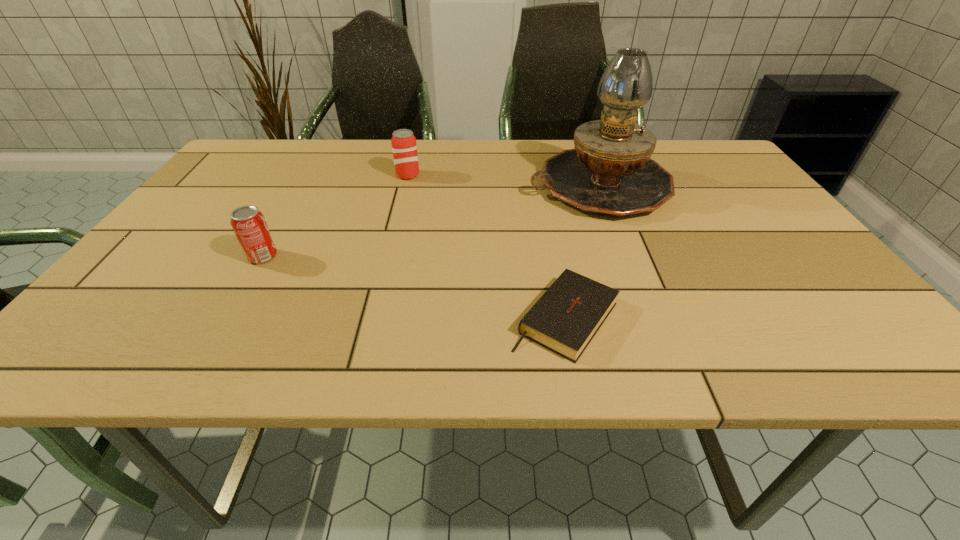
Find the location of a particular element. free region that satisfies the following two spatial constraints: 1. on the front side of the beer can; 2. on the left side of the oil lamp is located at coordinates (405, 186).

The width and height of the screenshot is (960, 540). Find the location of `free location that satisfies the following two spatial constraints: 1. on the front side of the shortest object; 2. on the left side of the soda can`. free location that satisfies the following two spatial constraints: 1. on the front side of the shortest object; 2. on the left side of the soda can is located at coordinates (227, 319).